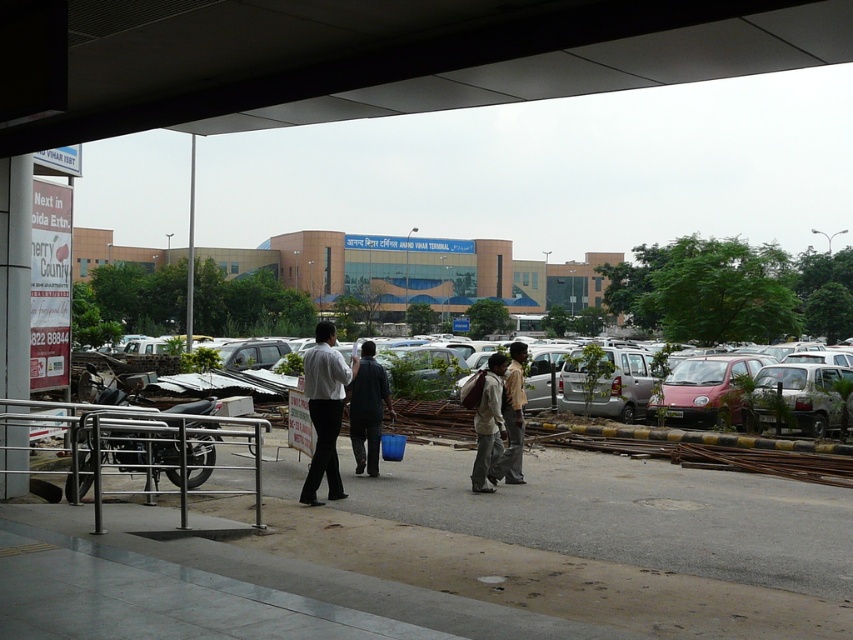
You are a photographer standing at the entrance of Anand Vihar Terminal. You notice two people wearing a white matte shirt at center and a dark blue shirt at center. Which person should you focus on if you want to capture someone taller?

The white matte shirt at center is taller than the dark blue shirt at center, so you should focus on the person wearing the white matte shirt at center.

You are a photographer standing at the Anand Vihar Terminal. You want to take a photo of the silver metallic rail at lower left and the silver metallic car at center so that both are visible in the frame. Which object should you focus on first to ensure both are in focus?

You should focus on the silver metallic car at center first because it is taller than the silver metallic rail at lower left, so focusing on the taller object ensures both will be in focus.

You are a photographer at the Anand Vihar Terminal. You notice two people wearing a white matte shirt at center and a dark blue shirt at center. Which person is standing closer to the camera?

The white matte shirt at center is located above the dark blue shirt at center, which indicates that the person wearing the white matte shirt at center is standing closer to the camera.